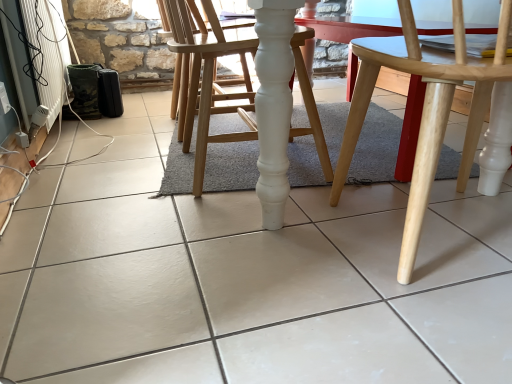
Locate an element on the screen. The image size is (512, 384). vacant space in front of white wood chair at center, the second chair positioned from the right is located at coordinates (207, 230).